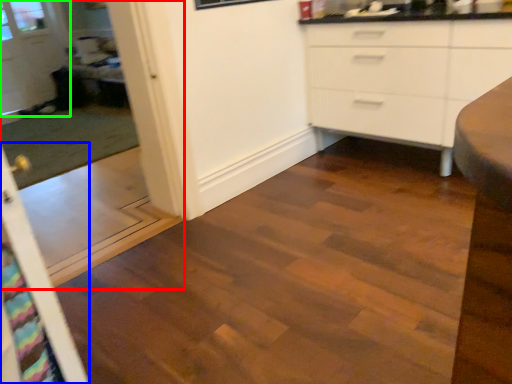
Question: Which object is the closest to the screen door (highlighted by a red box)? Choose among these: screen door (highlighted by a blue box) or glass door (highlighted by a green box).

Choices:
 (A) screen door
 (B) glass door

Answer: (B)